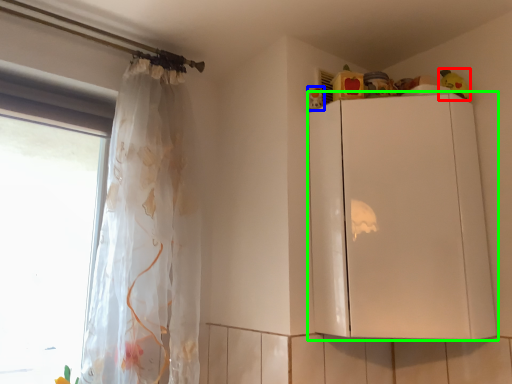
Question: Considering the real-world distances, which object is closest to toy (highlighted by a red box)? toy (highlighted by a blue box) or cabinetry (highlighted by a green box).

Choices:
 (A) toy
 (B) cabinetry

Answer: (A)